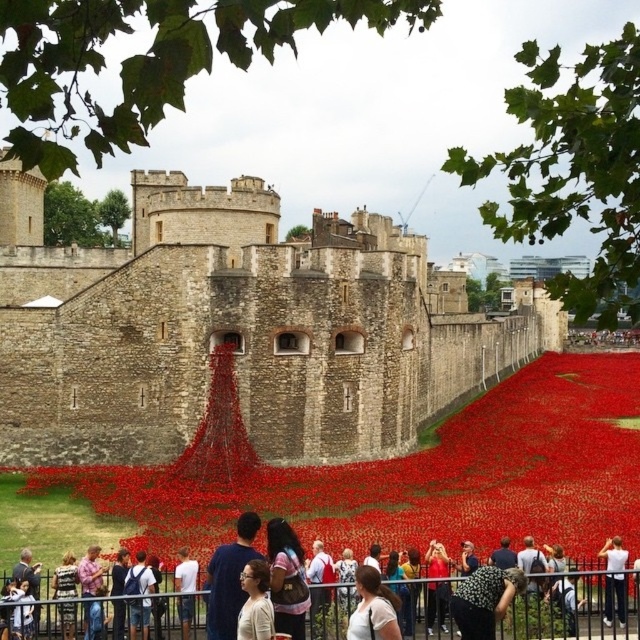
How far apart are floral-patterned shirt at center and white cotton shirt at center?

floral-patterned shirt at center is 4.48 meters from white cotton shirt at center.

Which is behind, point (486, 584) or point (387, 616)?

Positioned behind is point (486, 584).

Where is `floral-patterned shirt at center`? The width and height of the screenshot is (640, 640). floral-patterned shirt at center is located at coordinates (484, 600).

This screenshot has width=640, height=640. Describe the element at coordinates (614, 579) in the screenshot. I see `white cotton shirt at lower right` at that location.

Is point (612, 563) positioned in front of point (182, 636)?

No.

Identify the location of white cotton shirt at lower right. (614, 579).

Find the location of `white cotton shirt at lower right`. white cotton shirt at lower right is located at coordinates (614, 579).

Is white matte shirt at lower center wider than pink cotton shirt at lower left?

No, white matte shirt at lower center is not wider than pink cotton shirt at lower left.

Based on the photo, which is above, white matte shirt at lower center or pink cotton shirt at lower left?

white matte shirt at lower center is higher up.

You are a GUI agent. You are given a task and a screenshot of the screen. Output one action in this format:
    pyautogui.click(x=<x>, y=<y>)
    Task: Click on the white matte shirt at lower center
    The width and height of the screenshot is (640, 640).
    Given the screenshot: What is the action you would take?
    pyautogui.click(x=256, y=602)

I want to click on white matte shirt at lower center, so click(256, 602).